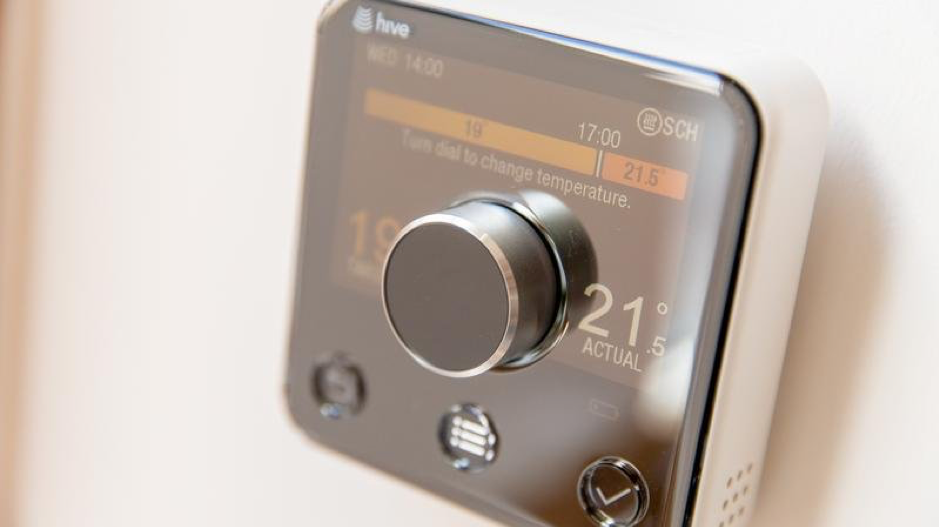
At what (x,y) coordinates should I click in order to perform the action: click on white wall. Please return your answer as a coordinate pair (x, y). This screenshot has width=939, height=527. Looking at the image, I should click on (214, 229).